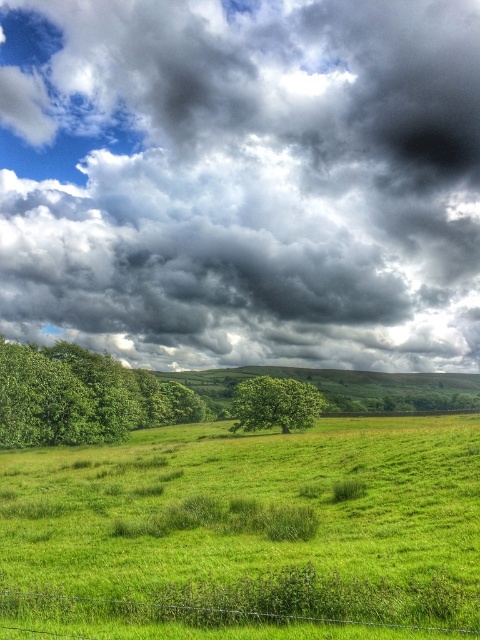
Question: Estimate the real-world distances between objects in this image. Which object is farther from the cloudy sky at upper center?

Choices:
 (A) green leafy tree at left
 (B) green leafy tree at center

Answer: (B)

Question: Is green leafy tree at left further to camera compared to wire mesh fence at lower center?

Choices:
 (A) yes
 (B) no

Answer: (A)

Question: In this image, where is cloudy sky at upper center located relative to wire mesh fence at lower center?

Choices:
 (A) left
 (B) right

Answer: (B)

Question: Does green leafy tree at left have a lesser width compared to green leafy tree at center?

Choices:
 (A) yes
 (B) no

Answer: (B)

Question: Among these points, which one is farthest from the camera?

Choices:
 (A) (182, 605)
 (B) (59, 417)

Answer: (B)

Question: Which point is farther to the camera?

Choices:
 (A) (228, 189)
 (B) (255, 410)
 (C) (47, 365)

Answer: (A)